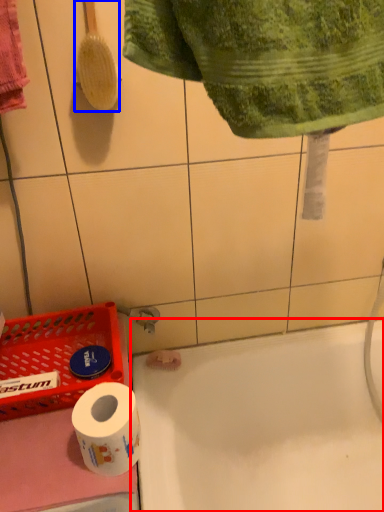
Question: Which object appears farthest to the camera in this image, bath (highlighted by a red box) or brush (highlighted by a blue box)?

Choices:
 (A) bath
 (B) brush

Answer: (A)